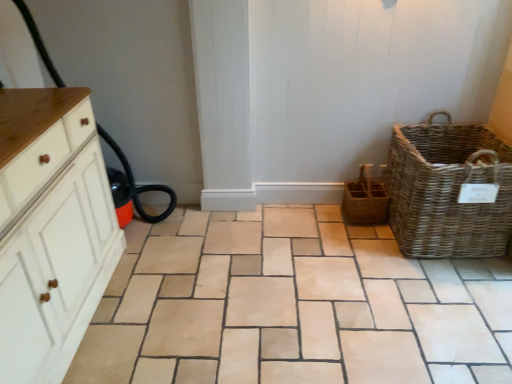
Identify the location of vacant space that is to the left of natural woven picnic basket at right. This screenshot has width=512, height=384. (345, 247).